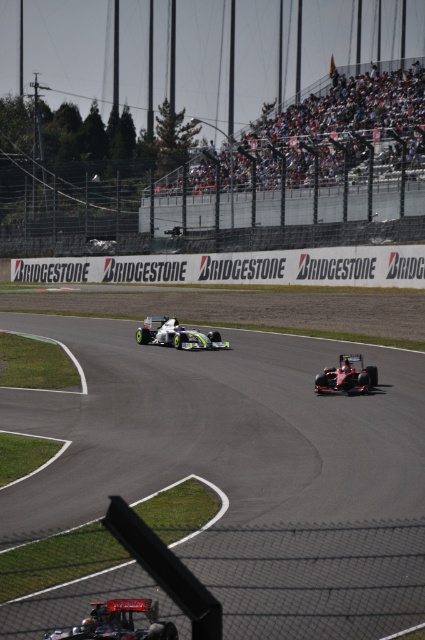
Based on the photo, you are a race car driver preparing for a turn on the track. You notice the smooth asphalt track at center and the black rubber tire at lower center. Which object is bigger in size?

The smooth asphalt track at center has a larger size compared to the black rubber tire at lower center.

You are a race car driver preparing for a turn on the track. You notice the smooth asphalt track at center and the black rubber tire at lower center. Which object is closer to your current position as you approach the turn?

The smooth asphalt track at center is closer to the viewer than the black rubber tire at lower center, so the smooth asphalt track at center is closer to your current position.

You are a race engineer observing the shiny metallic race car at lower center and the black rubber tire at lower center. Which object would block your view of a distant pit crew member standing behind them?

The shiny metallic race car at lower center would block your view of the distant pit crew member because it is larger in size than the black rubber tire at lower center.